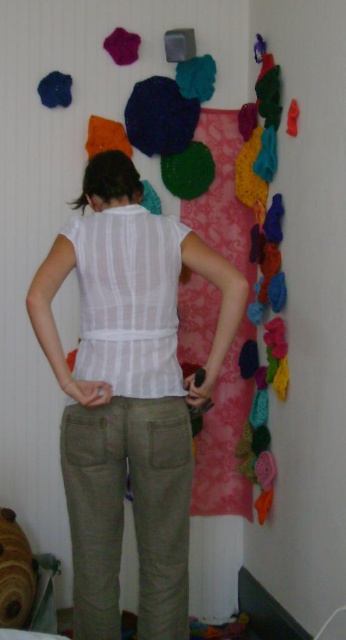
Question: Which of these objects is positioned closest to the olive green cotton pants at lower center?

Choices:
 (A) light beige cotton pants at center
 (B) matte blue fabric at upper left

Answer: (A)

Question: Which is farther from the light beige cotton pants at center?

Choices:
 (A) matte blue fabric at upper left
 (B) olive green cotton pants at lower center

Answer: (A)

Question: Does light beige cotton pants at center appear over white sheer shirt at center?

Choices:
 (A) no
 (B) yes

Answer: (A)

Question: Does olive green cotton pants at lower center have a larger size compared to white sheer shirt at center?

Choices:
 (A) no
 (B) yes

Answer: (B)

Question: Considering the real-world distances, which object is closest to the olive green cotton pants at lower center?

Choices:
 (A) light beige cotton pants at center
 (B) white sheer shirt at center
 (C) matte blue fabric at upper left

Answer: (A)

Question: Is white sheer shirt at center positioned at the back of matte blue fabric at upper left?

Choices:
 (A) no
 (B) yes

Answer: (A)